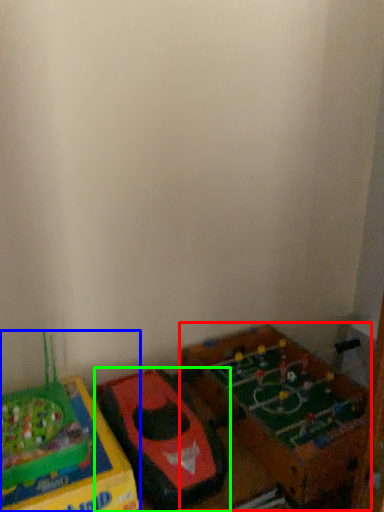
Question: Estimate the real-world distances between objects in this image. Which object is farther from toy (highlighted by a red box), toy (highlighted by a blue box) or toy (highlighted by a green box)?

Choices:
 (A) toy
 (B) toy

Answer: (A)